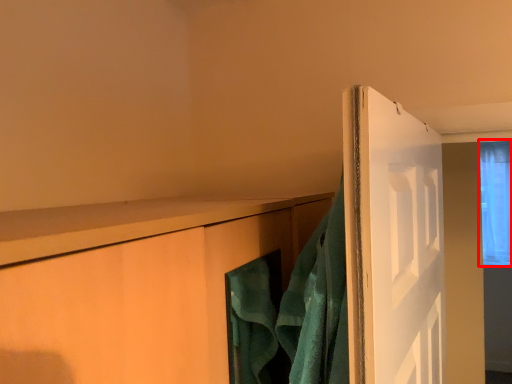
Question: From the image's perspective, what is the correct spatial relationship of window (annotated by the red box) in relation to bath towel?

Choices:
 (A) below
 (B) above

Answer: (B)